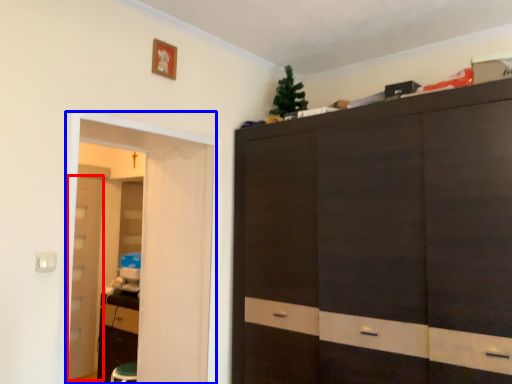
Question: Which point is further to the camera, door (highlighted by a red box) or screen door (highlighted by a blue box)?

Choices:
 (A) door
 (B) screen door

Answer: (A)